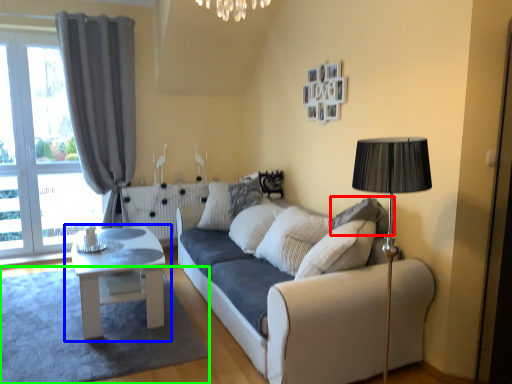
Question: Considering the real-world distances, which object is closest to pillow (highlighted by a red box)? table (highlighted by a blue box) or plain (highlighted by a green box).

Choices:
 (A) table
 (B) plain

Answer: (A)